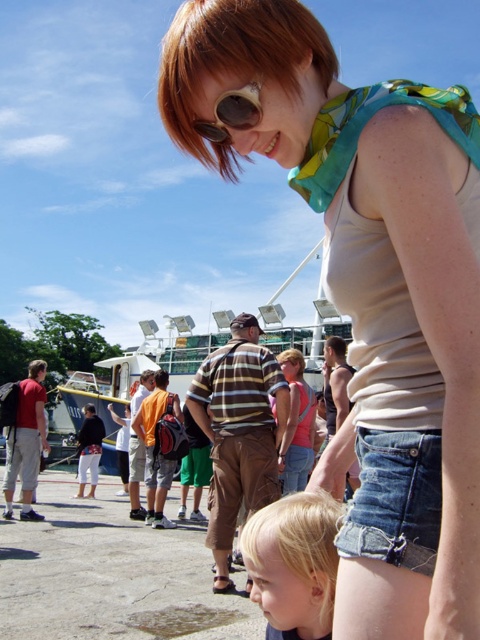
Which is more to the left, matte beige tank top at center or brown leather goggles at upper center?

Positioned to the left is brown leather goggles at upper center.

I want to click on matte beige tank top at center, so click(x=371, y=289).

Looking at this image, between white plastic boat at center and orange fabric backpack at center, which one has less height?

Standing shorter between the two is orange fabric backpack at center.

Who is taller, white plastic boat at center or orange fabric backpack at center?

white plastic boat at center is taller.

Is point (224, 339) farther from camera compared to point (148, 445)?

Yes, it is.

Where is `white plastic boat at center`? This screenshot has width=480, height=640. white plastic boat at center is located at coordinates (134, 380).

Does point (263, 540) lie behind point (173, 470)?

No, (263, 540) is closer to viewer.

Can you confirm if blonde hair at lower left is shorter than orange fabric backpack at center?

Result: Yes, blonde hair at lower left is shorter than orange fabric backpack at center.

Is point (287, 621) farther from camera compared to point (144, 445)?

That is False.

Locate an element on the screen. Image resolution: width=480 pixels, height=640 pixels. blonde hair at lower left is located at coordinates (294, 563).